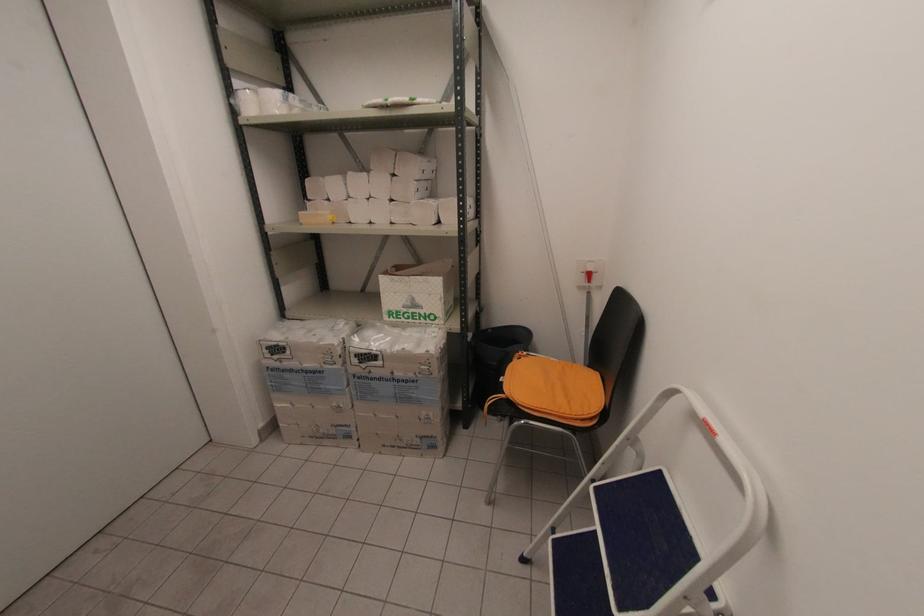
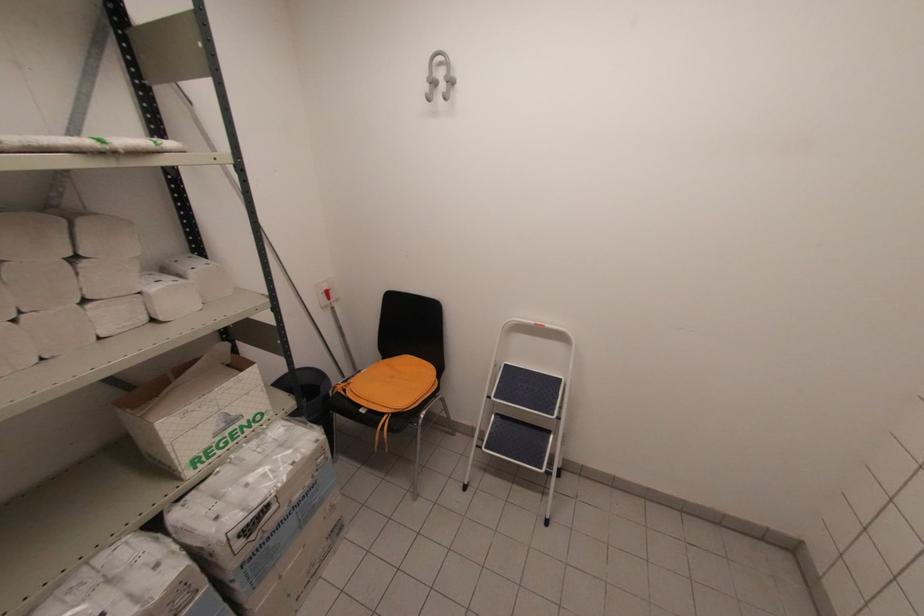
Find the pixel in the second image that matches [385,103] in the first image.

(107, 148)